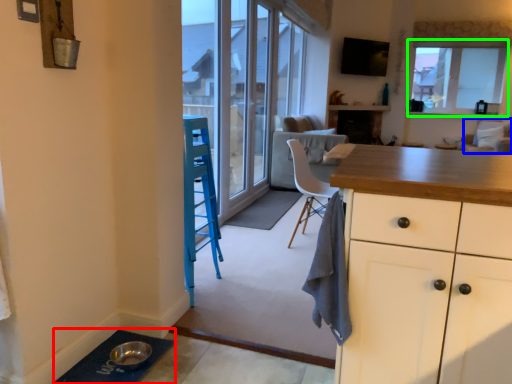
Question: Which object is positioned farthest from doormat (highlighted by a red box)? Select from armchair (highlighted by a blue box) and window (highlighted by a green box).

Choices:
 (A) armchair
 (B) window

Answer: (B)